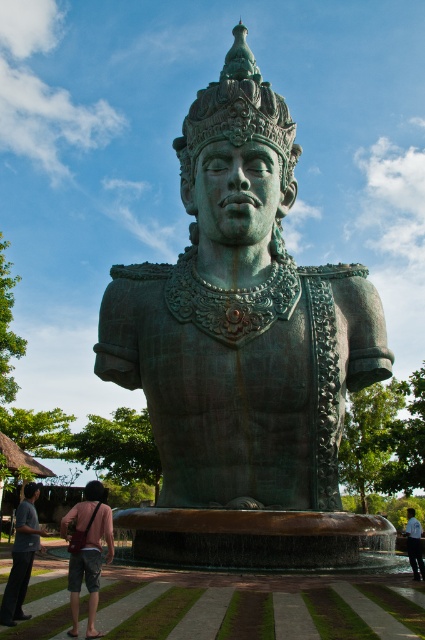
Question: Estimate the real-world distances between objects in this image. Which object is closer to the light blue shirt at lower right?

Choices:
 (A) green patina bronze statue at center
 (B) pink fabric bag at lower left

Answer: (A)

Question: Does pink fabric bag at lower left lie in front of matte bronze statue at lower left?

Choices:
 (A) no
 (B) yes

Answer: (B)

Question: Can you confirm if green patina bronze statue at center is thinner than light blue shirt at lower right?

Choices:
 (A) no
 (B) yes

Answer: (A)

Question: Among these objects, which one is nearest to the camera?

Choices:
 (A) matte bronze statue at lower left
 (B) green patina bronze statue at center
 (C) light blue shirt at lower right

Answer: (A)

Question: Is pink fabric bag at lower left to the right of light blue shirt at lower right from the viewer's perspective?

Choices:
 (A) yes
 (B) no

Answer: (B)

Question: Estimate the real-world distances between objects in this image. Which object is farther from the green patina bronze statue at center?

Choices:
 (A) matte bronze statue at lower left
 (B) light blue shirt at lower right

Answer: (B)